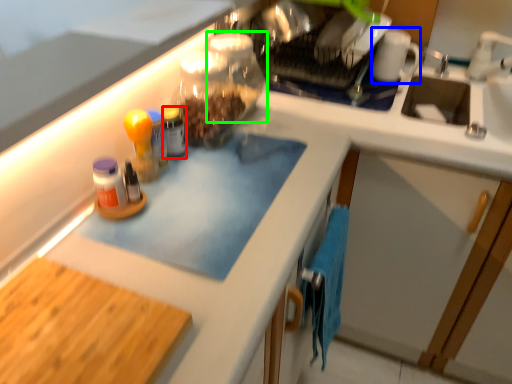
Question: Which object is positioned closest to bottle (highlighted by a red box)? Select from mug (highlighted by a blue box) and glass jar (highlighted by a green box).

Choices:
 (A) mug
 (B) glass jar

Answer: (B)